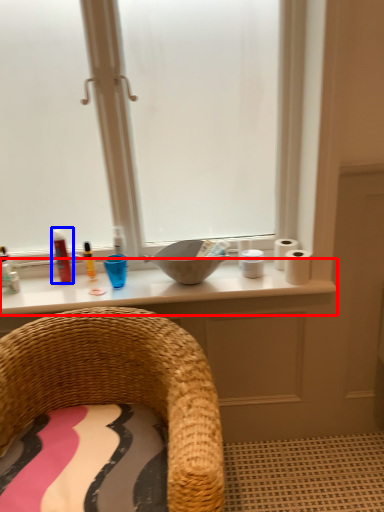
Question: Among these objects, which one is farthest to the camera, counter top (highlighted by a red box) or toiletry (highlighted by a blue box)?

Choices:
 (A) counter top
 (B) toiletry

Answer: (B)